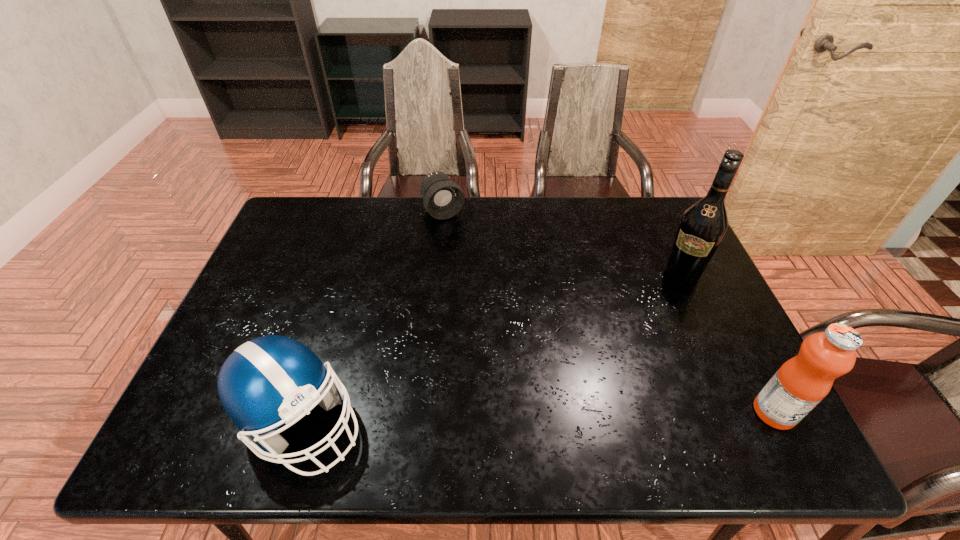
The image size is (960, 540). What are the coordinates of `free spot on the desktop that is between the football helmet and the second tallest object and is positioned at the front element of the telephoto lens` in the screenshot? It's located at (568, 416).

Identify the location of free spot on the desktop that is between the football helmet and the second tallest object and is positioned on the label of the wine bottle. The height and width of the screenshot is (540, 960). (607, 416).